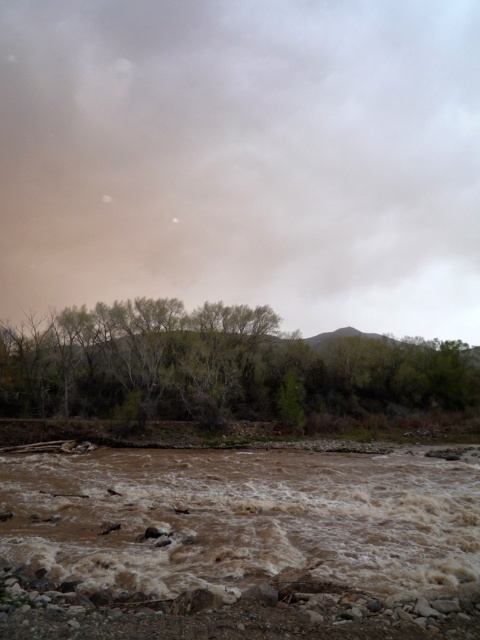
Question: Is brown muddy water at lower center positioned behind green leafy trees at center?

Choices:
 (A) no
 (B) yes

Answer: (A)

Question: Which point is closer to the camera taking this photo?

Choices:
 (A) (359, 580)
 (B) (103, 376)

Answer: (A)

Question: Can you confirm if brown muddy water at lower center is bigger than green leafy trees at center?

Choices:
 (A) no
 (B) yes

Answer: (A)

Question: Among these objects, which one is nearest to the camera?

Choices:
 (A) green leafy trees at center
 (B) brown muddy water at lower center

Answer: (B)

Question: Where is brown muddy water at lower center located in relation to green leafy trees at center in the image?

Choices:
 (A) right
 (B) left

Answer: (B)

Question: Which object is closer to the camera taking this photo?

Choices:
 (A) green leafy trees at center
 (B) brown muddy water at lower center

Answer: (B)